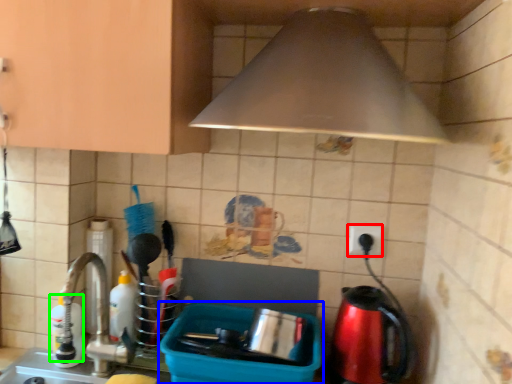
Question: Estimate the real-world distances between objects in this image. Which object is closer to electric outlet (highlighted by a red box), appliance (highlighted by a blue box) or bottle (highlighted by a green box)?

Choices:
 (A) appliance
 (B) bottle

Answer: (A)